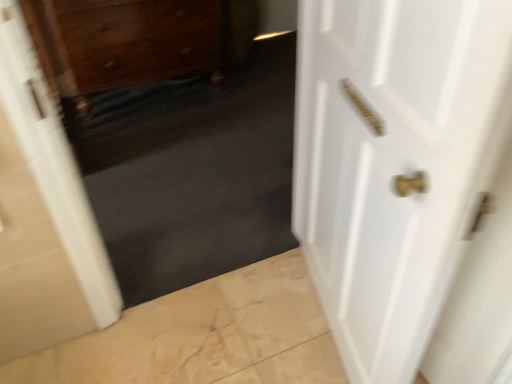
Question: Can you confirm if dark matte carpet at center is thinner than wooden drawer at upper left?

Choices:
 (A) yes
 (B) no

Answer: (A)

Question: Is dark matte carpet at center positioned in front of wooden drawer at upper left?

Choices:
 (A) no
 (B) yes

Answer: (B)

Question: Is dark matte carpet at center at the left side of wooden drawer at upper left?

Choices:
 (A) no
 (B) yes

Answer: (A)

Question: Is dark matte carpet at center positioned far away from wooden drawer at upper left?

Choices:
 (A) yes
 (B) no

Answer: (B)

Question: Can you confirm if dark matte carpet at center is shorter than wooden drawer at upper left?

Choices:
 (A) yes
 (B) no

Answer: (B)

Question: Based on their positions, is white glossy door at right located to the left or right of wooden drawer at upper left?

Choices:
 (A) right
 (B) left

Answer: (A)

Question: From a real-world perspective, relative to wooden drawer at upper left, is white glossy door at right vertically above or below?

Choices:
 (A) below
 (B) above

Answer: (B)

Question: Based on their sizes in the image, would you say white glossy door at right is bigger or smaller than wooden drawer at upper left?

Choices:
 (A) small
 (B) big

Answer: (A)

Question: Is white glossy door at right inside or outside of wooden drawer at upper left?

Choices:
 (A) inside
 (B) outside

Answer: (B)

Question: Is wooden drawer at upper left spatially inside dark matte carpet at center, or outside of it?

Choices:
 (A) outside
 (B) inside

Answer: (A)

Question: Does point (124, 29) appear closer or farther from the camera than point (152, 238)?

Choices:
 (A) closer
 (B) farther

Answer: (B)

Question: From a real-world perspective, is wooden drawer at upper left physically located above or below dark matte carpet at center?

Choices:
 (A) above
 (B) below

Answer: (B)

Question: From the image's perspective, is wooden drawer at upper left located above or below dark matte carpet at center?

Choices:
 (A) below
 (B) above

Answer: (B)

Question: In terms of size, does dark matte carpet at center appear bigger or smaller than white glossy door at right?

Choices:
 (A) small
 (B) big

Answer: (B)

Question: Relative to white glossy door at right, is dark matte carpet at center in front or behind?

Choices:
 (A) behind
 (B) front

Answer: (A)